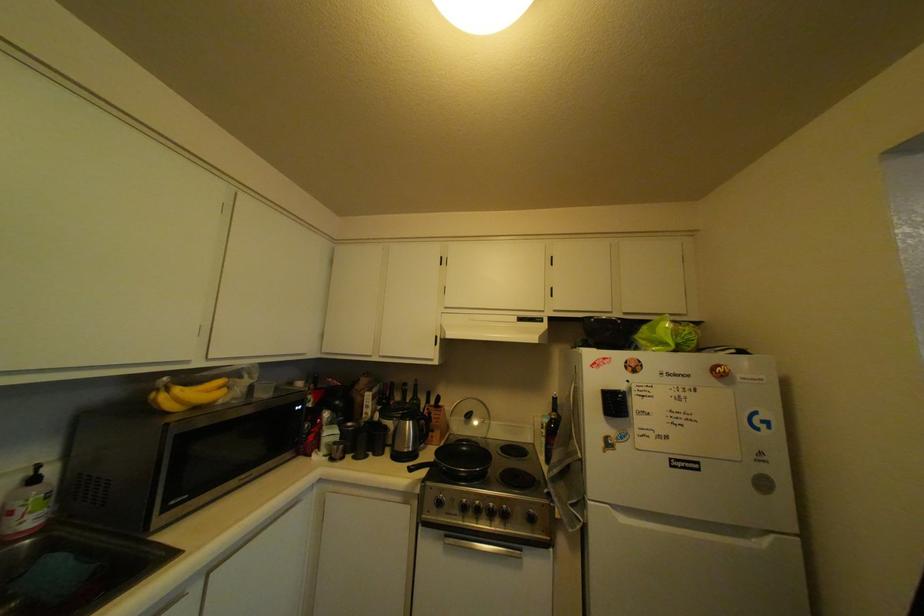
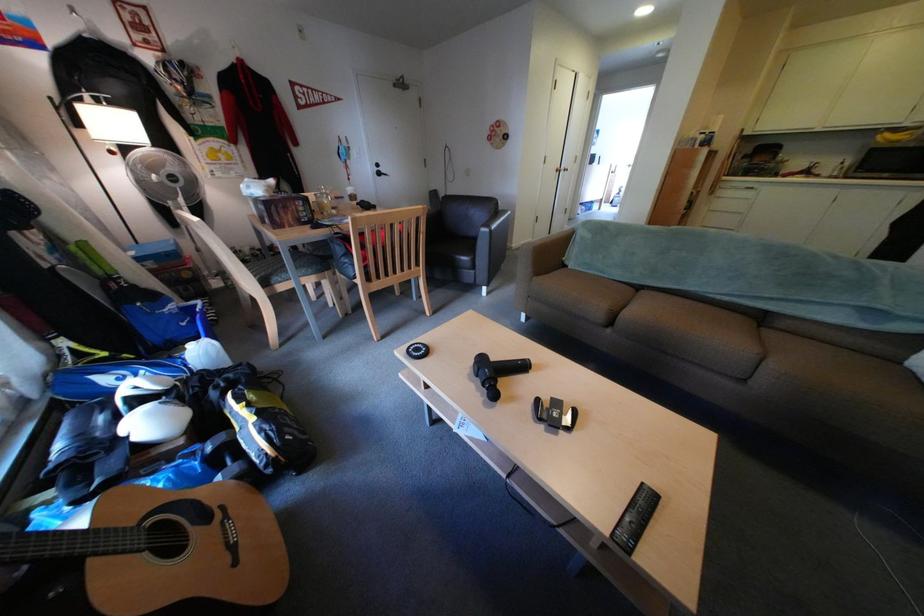
The point at [176,398] is marked in the first image. Where is the corresponding point in the second image?

(894, 138)